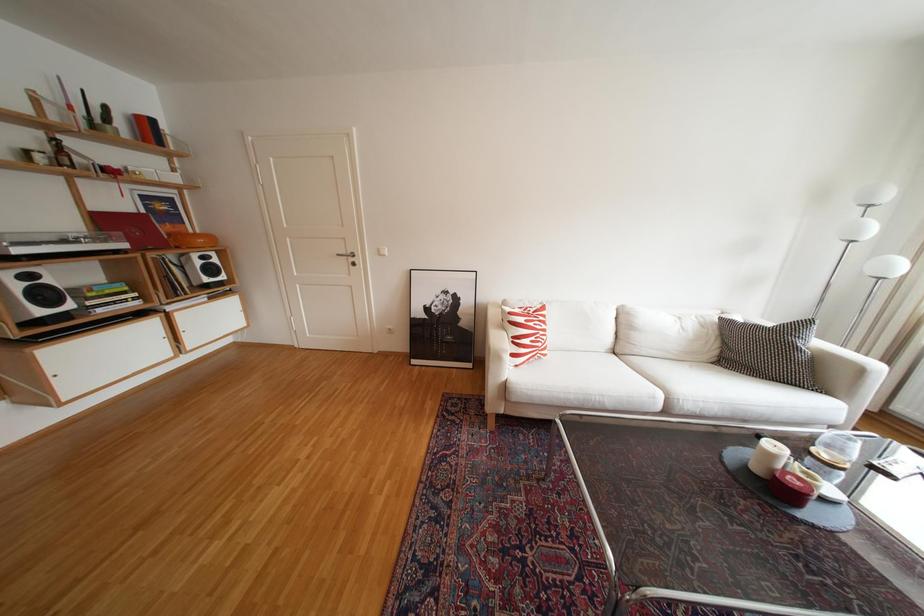
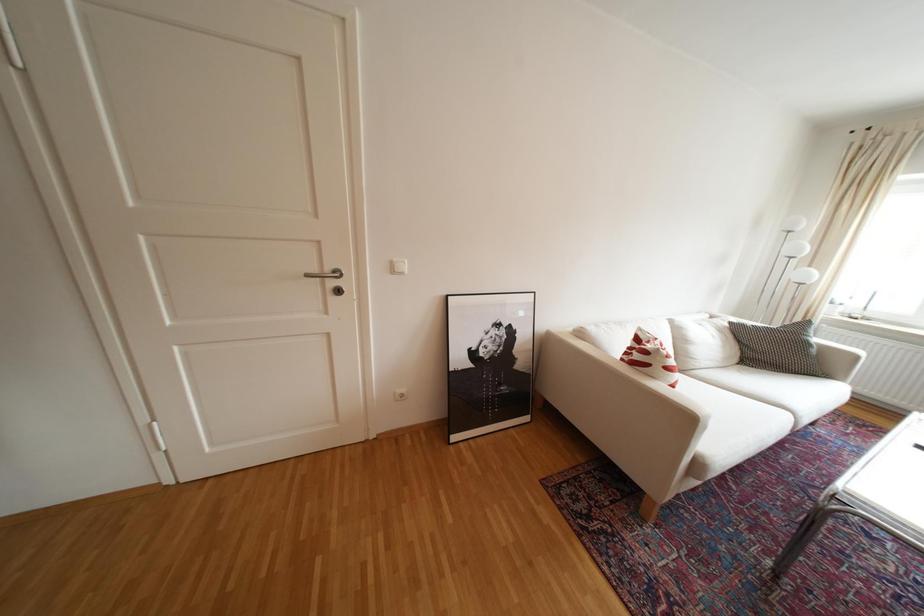
What movement of the cameraman would produce the second image?

The cameraman walked toward left, forward.